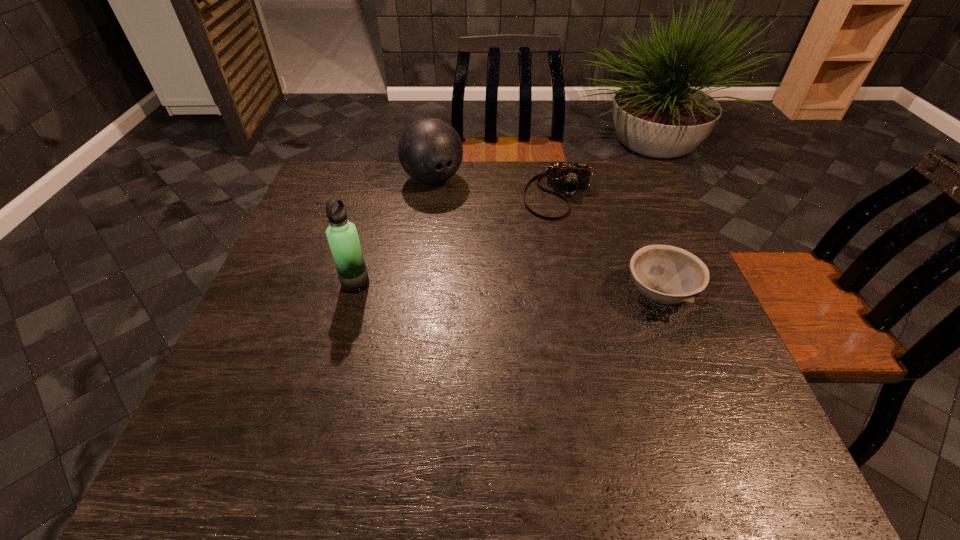
Find the location of a particular element. This screenshot has height=540, width=960. the leftmost object is located at coordinates pos(342,236).

Where is `thermos bottle`? Image resolution: width=960 pixels, height=540 pixels. thermos bottle is located at coordinates (342, 236).

Where is `the third tallest object`? The height and width of the screenshot is (540, 960). the third tallest object is located at coordinates (668, 275).

Find the location of a particular element. the second tallest object is located at coordinates (430, 150).

Image resolution: width=960 pixels, height=540 pixels. In order to click on the third object from right to left in this screenshot , I will do `click(430, 150)`.

This screenshot has height=540, width=960. I want to click on the shortest object, so (571, 177).

Identify the location of free space located on the right of the tallest object. This screenshot has height=540, width=960. (428, 284).

Locate an element on the screen. This screenshot has width=960, height=540. free location located on the back of the bowl is located at coordinates (630, 219).

Locate an element on the screen. This screenshot has width=960, height=540. free space located 0.080m on the grip area of the third object from right to left is located at coordinates (460, 208).

At what (x,y) coordinates should I click in order to perform the action: click on vacant space situated on the grip area of the third object from right to left. Please return your answer as a coordinate pair (x, y). The image size is (960, 540). Looking at the image, I should click on (458, 207).